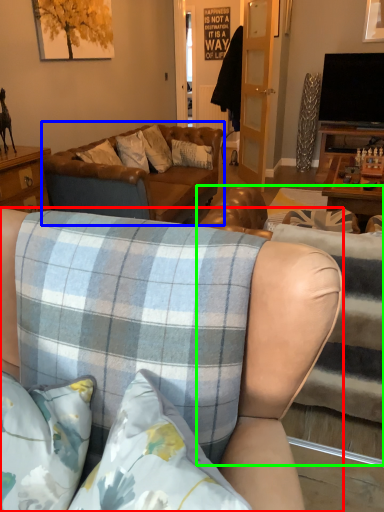
Question: Which is farther away from studio couch (highlighted by a red box)? studio couch (highlighted by a blue box) or studio couch (highlighted by a green box)?

Choices:
 (A) studio couch
 (B) studio couch

Answer: (A)